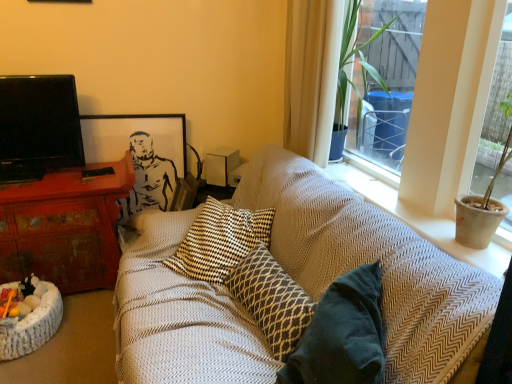
This screenshot has width=512, height=384. What do you see at coordinates (31, 326) in the screenshot?
I see `woven fabric cat bed at lower left` at bounding box center [31, 326].

Where is `black glossy tv at left`? Image resolution: width=512 pixels, height=384 pixels. black glossy tv at left is located at coordinates (38, 126).

This screenshot has width=512, height=384. Identify the location of white sheer curtain at upper right. (311, 76).

At what (x,y) coordinates should I click in order to perform the action: click on white matte speaker at upper center. Please return your answer as a coordinate pair (x, y). Image resolution: width=512 pixels, height=384 pixels. Looking at the image, I should click on (221, 165).

The height and width of the screenshot is (384, 512). Find the location of `patterned fabric pillow at center`. patterned fabric pillow at center is located at coordinates (271, 300).

Measure the distance between point (150,170) and camera.

Point (150,170) is 9.10 feet away from camera.

At what (x,y) coordinates should I click in order to perform the action: click on woven fabric cat bed at lower left. Please return your answer as a coordinate pair (x, y). This screenshot has width=512, height=384. Looking at the image, I should click on (31, 326).

Looking at this image, is textured beige cushion at upper right at the right side of woven fabric cat bed at lower left?

Yes, textured beige cushion at upper right is to the right of woven fabric cat bed at lower left.

Is textured beige cushion at upper right wider than woven fabric cat bed at lower left?

In fact, textured beige cushion at upper right might be narrower than woven fabric cat bed at lower left.

Which of these two, textured beige cushion at upper right or woven fabric cat bed at lower left, stands taller?

With more height is textured beige cushion at upper right.

In the image, is white sheer curtain at upper right positioned in front of or behind distressed wood desk at left?

Visually, white sheer curtain at upper right is located in front of distressed wood desk at left.

Is white sheer curtain at upper right oriented towards distressed wood desk at left?

Yes, white sheer curtain at upper right is facing distressed wood desk at left.

From their relative heights in the image, would you say white sheer curtain at upper right is taller or shorter than distressed wood desk at left?

In the image, white sheer curtain at upper right appears to be taller than distressed wood desk at left.

From the image's perspective, which one is positioned higher, white matte speaker at upper center or patterned fabric pillow at center?

white matte speaker at upper center is shown above in the image.

From the picture: Which of these two, white matte speaker at upper center or patterned fabric pillow at center, stands taller?

Standing taller between the two is patterned fabric pillow at center.

Between point (215, 170) and point (258, 323), which one is positioned in front?

The point (258, 323) is more forward.

From a real-world perspective, is white matte speaker at upper center physically below patterned fabric pillow at center?

No, from a real-world perspective, white matte speaker at upper center is not under patterned fabric pillow at center.

Between point (68, 126) and point (155, 186), which one is positioned behind?

The point (155, 186) is farther.

Considering the sizes of objects black glossy tv at left and black matte picture frame at upper left in the image provided, who is smaller, black glossy tv at left or black matte picture frame at upper left?

black matte picture frame at upper left.

Are black glossy tv at left and black matte picture frame at upper left far apart?

They are positioned close to each other.

Is black glossy tv at left closer to camera compared to black matte picture frame at upper left?

Yes, black glossy tv at left is closer to the camera.

Considering the sizes of distressed wood desk at left and black matte picture frame at upper left in the image, is distressed wood desk at left wider or thinner than black matte picture frame at upper left?

In the image, distressed wood desk at left appears to be wider than black matte picture frame at upper left.

From the image's perspective, who appears lower, distressed wood desk at left or black matte picture frame at upper left?

distressed wood desk at left.

Does distressed wood desk at left lie in front of black matte picture frame at upper left?

Yes, distressed wood desk at left is in front of black matte picture frame at upper left.

From their relative heights in the image, would you say black matte picture frame at upper left is taller or shorter than woven fabric cat bed at lower left?

black matte picture frame at upper left is taller than woven fabric cat bed at lower left.

Which object is closer to the camera, black matte picture frame at upper left or woven fabric cat bed at lower left?

woven fabric cat bed at lower left is in front.

From the image's perspective, which object appears higher, black matte picture frame at upper left or woven fabric cat bed at lower left?

black matte picture frame at upper left appears higher in the image.

Who is bigger, black matte picture frame at upper left or woven fabric cat bed at lower left?

black matte picture frame at upper left.

Are patterned fabric pillow at center and woven fabric cat bed at lower left far apart?

Yes.

From their relative heights in the image, would you say patterned fabric pillow at center is taller or shorter than woven fabric cat bed at lower left?

Clearly, patterned fabric pillow at center is taller compared to woven fabric cat bed at lower left.

Between point (258, 265) and point (0, 344), which one is positioned in front?

The point (258, 265) is in front.

Where is `cat bed that is behind the patterned fabric pillow at center`? The width and height of the screenshot is (512, 384). cat bed that is behind the patterned fabric pillow at center is located at coordinates (31, 326).

At what (x,y) coordinates should I click in order to perform the action: click on bay window that is above the woven fabric cat bed at lower left (from a real-world perspective). Please return your answer as a coordinate pair (x, y). Image resolution: width=512 pixels, height=384 pixels. Looking at the image, I should click on (449, 102).

Locate an element on the screen. The image size is (512, 384). desk that appears behind the white sheer curtain at upper right is located at coordinates (64, 228).

When comparing their distances from textured beige cushion at upper right, does white sheer curtain at upper right or black matte picture frame at upper left seem closer?

The object closer to textured beige cushion at upper right is white sheer curtain at upper right.

Considering their positions, is white sheer curtain at upper right positioned further to distressed wood desk at left than white matte speaker at upper center?

The object further to distressed wood desk at left is white sheer curtain at upper right.

Which object lies further to the anchor point woven fabric cat bed at lower left, textured beige cushion at upper right or white matte speaker at upper center?

The object further to woven fabric cat bed at lower left is textured beige cushion at upper right.

Which object lies nearer to the anchor point black matte picture frame at upper left, woven fabric cat bed at lower left or white matte speaker at upper center?

The object closer to black matte picture frame at upper left is white matte speaker at upper center.

Considering their positions, is patterned fabric pillow at center positioned closer to textured beige cushion at upper right than woven fabric cat bed at lower left?

patterned fabric pillow at center lies closer to textured beige cushion at upper right than the other object.

From the image, which object appears to be nearer to white matte speaker at upper center, black matte picture frame at upper left or textured beige cushion at upper right?

Among the two, black matte picture frame at upper left is located nearer to white matte speaker at upper center.

When comparing their distances from distressed wood desk at left, does white matte speaker at upper center or patterned fabric pillow at center seem further?

patterned fabric pillow at center is positioned further to the anchor distressed wood desk at left.

From the image, which object appears to be nearer to white sheer curtain at upper right, black glossy tv at left or woven fabric cat bed at lower left?

Based on the image, black glossy tv at left appears to be nearer to white sheer curtain at upper right.

This screenshot has height=384, width=512. In order to click on desk located between black glossy tv at left and textured beige cushion at upper right in the left-right direction in this screenshot , I will do `click(64, 228)`.

Identify the location of cat bed between black glossy tv at left and textured beige cushion at upper right. coord(31,326).

Where is `cat bed between black glossy tv at left and white sheer curtain at upper right in the horizontal direction`? The image size is (512, 384). cat bed between black glossy tv at left and white sheer curtain at upper right in the horizontal direction is located at coordinates (31, 326).

Identify the location of curtain located between woven fabric cat bed at lower left and textured beige cushion at upper right in the left-right direction. (311, 76).